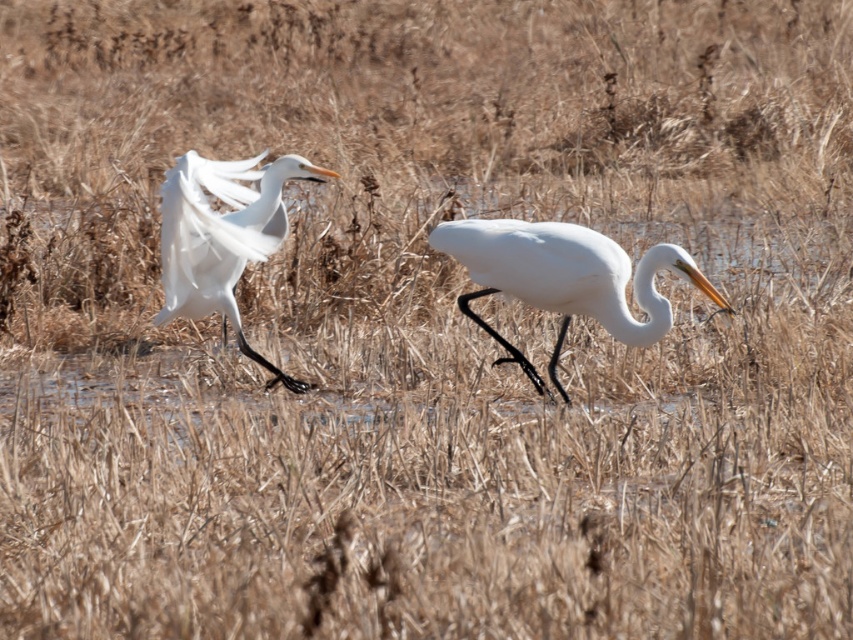
You are a wildlife photographer observing two herons in a wetland. You notice the white smooth heron at center and the white feathered bird at center. Which heron should you focus on if you want to capture the larger bird in your shot?

The white feathered bird at center is larger than the white smooth heron at center, so you should focus on the white feathered bird at center to capture the larger bird in your shot.

You are a birdwatcher observing two herons in a wetland. You notice a white smooth heron at center and a white feathered bird at center. Which one is taller?

The white smooth heron at center is shorter than the white feathered bird at center, so the white feathered bird at center is taller.

You are observing two white birds in a wetland. You notice a white smooth heron at center and a white feathered bird at center. Which of these two birds is positioned to the right of the other?

The white smooth heron at center is positioned to the right of the white feathered bird at center.